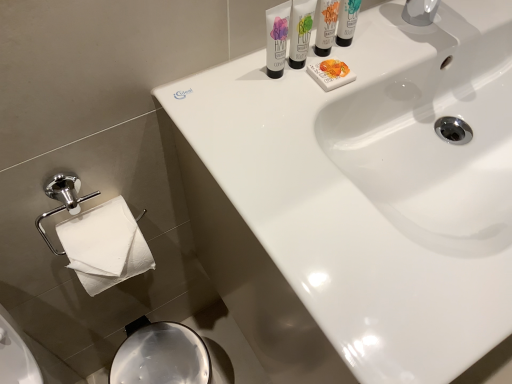
Question: Is white glossy tube at upper center, arranged as the third shaving cream when viewed from the right, oriented towards matte white shaving cream at upper center, the 2th shaving cream viewed from the left?

Choices:
 (A) yes
 (B) no

Answer: (B)

Question: From a real-world perspective, is white glossy tube at upper center, arranged as the 1th shaving cream when viewed from the left, located beneath matte white shaving cream at upper center, the 2th shaving cream viewed from the left?

Choices:
 (A) no
 (B) yes

Answer: (B)

Question: Is white glossy tube at upper center, arranged as the 1th shaving cream when viewed from the left, located outside matte white shaving cream at upper center, the 2th shaving cream viewed from the left?

Choices:
 (A) no
 (B) yes

Answer: (B)

Question: Does white glossy tube at upper center, arranged as the 1th shaving cream when viewed from the left, have a greater width compared to matte white shaving cream at upper center, the second shaving cream in the right-to-left sequence?

Choices:
 (A) yes
 (B) no

Answer: (B)

Question: Considering the relative positions of white glossy tube at upper center, arranged as the 1th shaving cream when viewed from the left, and matte white shaving cream at upper center, the second shaving cream in the right-to-left sequence, in the image provided, is white glossy tube at upper center, arranged as the 1th shaving cream when viewed from the left, in front of matte white shaving cream at upper center, the second shaving cream in the right-to-left sequence,?

Choices:
 (A) no
 (B) yes

Answer: (B)

Question: Looking at their shapes, would you say white glossy tube at upper center, arranged as the 1th shaving cream when viewed from the left, is wider or thinner than white matte soap at upper center?

Choices:
 (A) wide
 (B) thin

Answer: (B)

Question: From the image's perspective, is white glossy tube at upper center, arranged as the 1th shaving cream when viewed from the left, above or below white matte soap at upper center?

Choices:
 (A) below
 (B) above

Answer: (B)

Question: Does point (281, 71) appear closer or farther from the camera than point (318, 66)?

Choices:
 (A) closer
 (B) farther

Answer: (A)

Question: From a real-world perspective, is white glossy tube at upper center, arranged as the third shaving cream when viewed from the right, positioned above or below white matte soap at upper center?

Choices:
 (A) above
 (B) below

Answer: (A)

Question: In the image, is white matte soap at upper center positioned in front of or behind white glossy tube at upper center, arranged as the 1th shaving cream when viewed from the left?

Choices:
 (A) behind
 (B) front

Answer: (A)

Question: Is white matte soap at upper center taller or shorter than white glossy tube at upper center, arranged as the third shaving cream when viewed from the right?

Choices:
 (A) tall
 (B) short

Answer: (B)

Question: From a real-world perspective, is white matte soap at upper center positioned above or below white glossy tube at upper center, arranged as the third shaving cream when viewed from the right?

Choices:
 (A) below
 (B) above

Answer: (A)

Question: Is white matte soap at upper center bigger or smaller than white glossy tube at upper center, arranged as the third shaving cream when viewed from the right?

Choices:
 (A) big
 (B) small

Answer: (B)

Question: In the image, is matte white shaving cream at upper center, the 2th shaving cream viewed from the left, positioned in front of or behind white glossy sink at upper center?

Choices:
 (A) front
 (B) behind

Answer: (B)

Question: Is point (296, 36) positioned closer to the camera than point (492, 96)?

Choices:
 (A) farther
 (B) closer

Answer: (B)